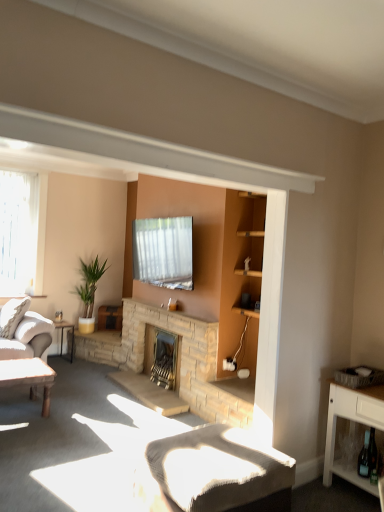
The height and width of the screenshot is (512, 384). I want to click on blank space situated above white textured cushion at lower center (from a real-world perspective), so click(210, 449).